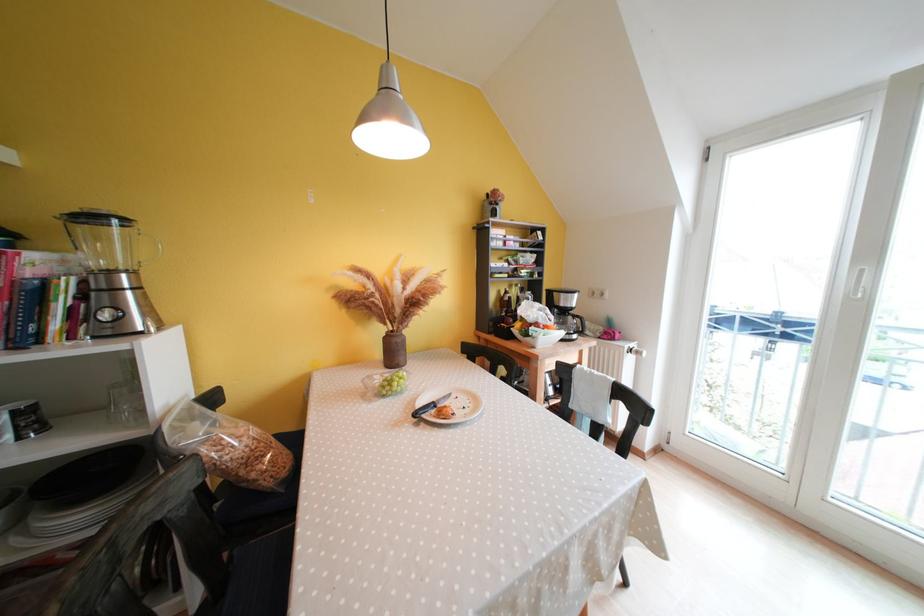
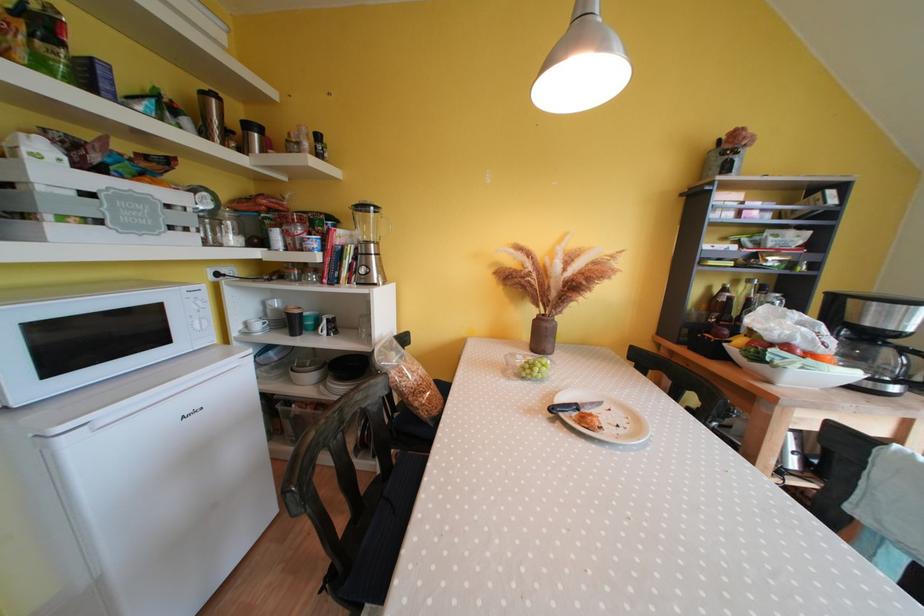
Find the pixel in the second image that matches point 129,280 in the first image.

(379, 249)